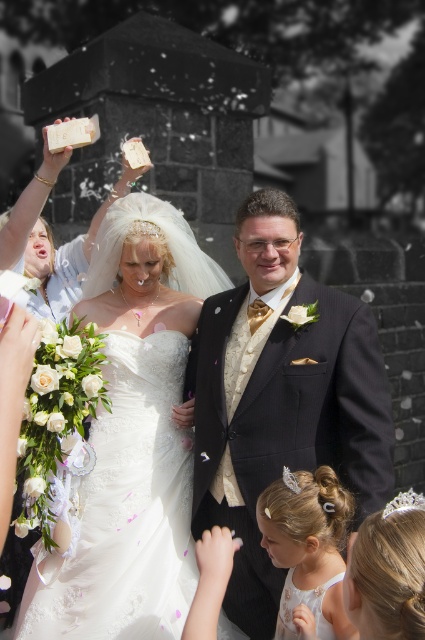
Question: Considering the relative positions of shiny black suit at center and matte white dress at upper left in the image provided, where is shiny black suit at center located with respect to matte white dress at upper left?

Choices:
 (A) right
 (B) left

Answer: (A)

Question: Estimate the real-world distances between objects in this image. Which object is farther from the white lace dress at lower right?

Choices:
 (A) white satin dress at center
 (B) shiny black suit at center

Answer: (A)

Question: Can you confirm if shiny black suit at center is positioned to the left of matte white dress at upper left?

Choices:
 (A) no
 (B) yes

Answer: (A)

Question: Estimate the real-world distances between objects in this image. Which object is farther from the matte white dress at upper left?

Choices:
 (A) white lace dress at lower right
 (B) white satin dress at center

Answer: (A)

Question: Does white satin dress at center appear on the left side of matte white dress at upper left?

Choices:
 (A) yes
 (B) no

Answer: (B)

Question: Which of the following is the farthest from the observer?

Choices:
 (A) matte white dress at upper left
 (B) white lace dress at lower right
 (C) white satin dress at center
 (D) shiny black suit at center

Answer: (A)